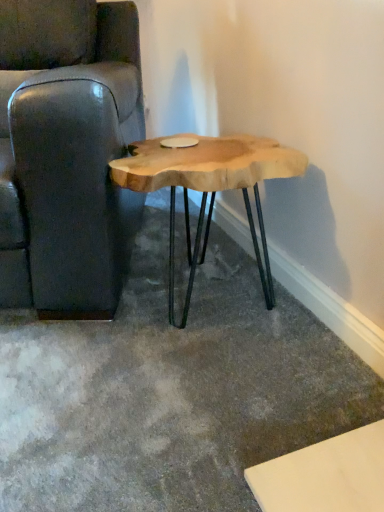
Question: Is leather couch at left in front of or behind natural wood table at center in the image?

Choices:
 (A) front
 (B) behind

Answer: (A)

Question: Based on their sizes in the image, would you say leather couch at left is bigger or smaller than natural wood table at center?

Choices:
 (A) big
 (B) small

Answer: (A)

Question: Do you think leather couch at left is within natural wood table at center, or outside of it?

Choices:
 (A) inside
 (B) outside

Answer: (B)

Question: From their relative heights in the image, would you say natural wood table at center is taller or shorter than leather couch at left?

Choices:
 (A) short
 (B) tall

Answer: (A)

Question: Is natural wood table at center to the left or to the right of leather couch at left in the image?

Choices:
 (A) left
 (B) right

Answer: (B)

Question: From a real-world perspective, is natural wood table at center physically located above or below leather couch at left?

Choices:
 (A) above
 (B) below

Answer: (B)

Question: From the image's perspective, is natural wood table at center located above or below leather couch at left?

Choices:
 (A) above
 (B) below

Answer: (B)